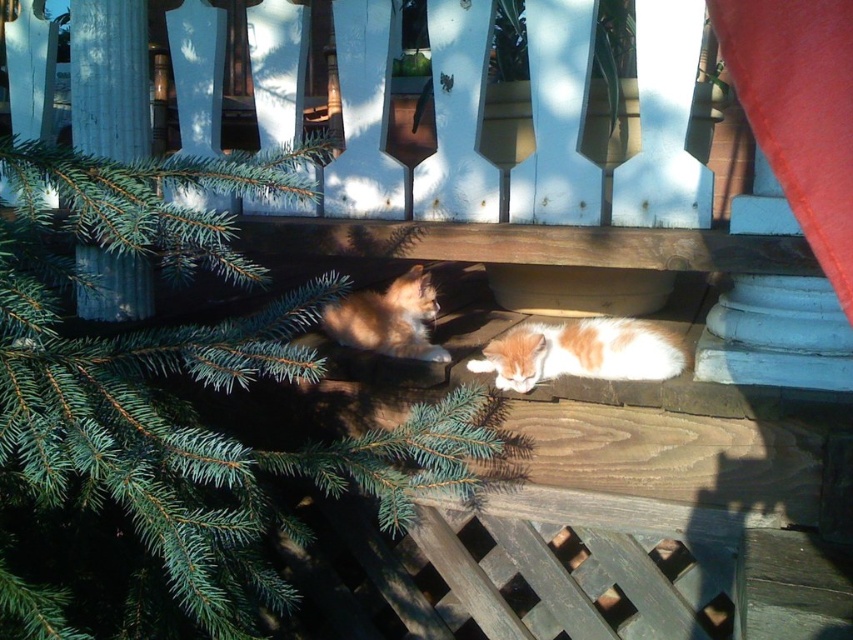
Question: Estimate the real-world distances between objects in this image. Which object is farther from the green needle-like tree at lower left?

Choices:
 (A) orange-white fur cat at center
 (B) orange fur cat at left

Answer: (A)

Question: Which of the following is the farthest from the observer?

Choices:
 (A) (566, 358)
 (B) (426, 460)
 (C) (427, 330)

Answer: (C)

Question: Can you confirm if green needle-like tree at lower left is thinner than orange-white fur cat at center?

Choices:
 (A) no
 (B) yes

Answer: (A)

Question: Which of the following is the closest to the observer?

Choices:
 (A) (155, 506)
 (B) (424, 344)
 (C) (590, 326)

Answer: (A)

Question: Considering the relative positions of green needle-like tree at lower left and orange-white fur cat at center in the image provided, where is green needle-like tree at lower left located with respect to orange-white fur cat at center?

Choices:
 (A) below
 (B) above

Answer: (B)

Question: Is green needle-like tree at lower left bigger than orange-white fur cat at center?

Choices:
 (A) yes
 (B) no

Answer: (A)